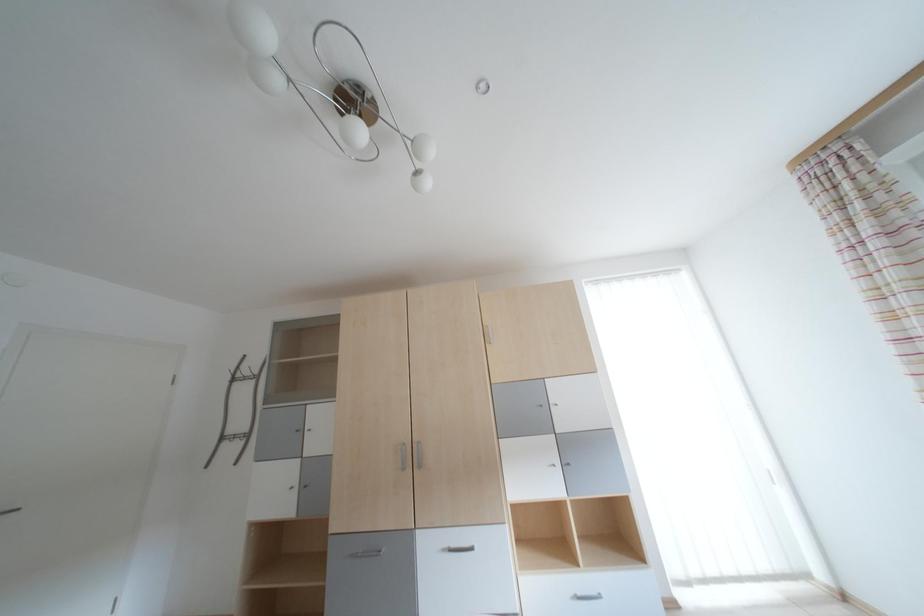
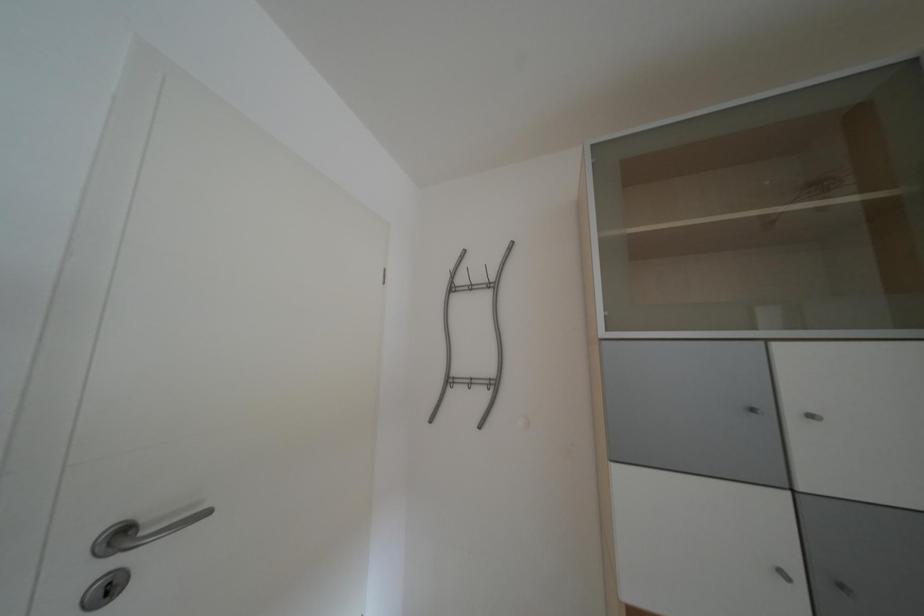
The images are taken continuously from a first-person perspective. In which direction are you moving?

The cameraman moved toward left, forward.